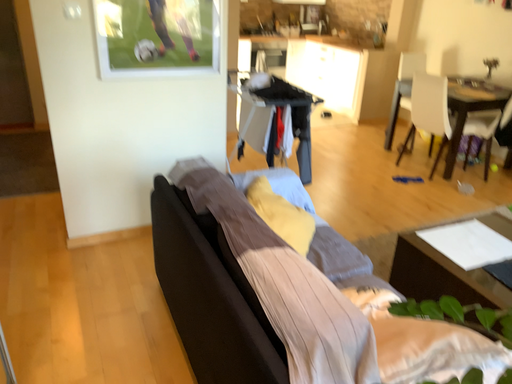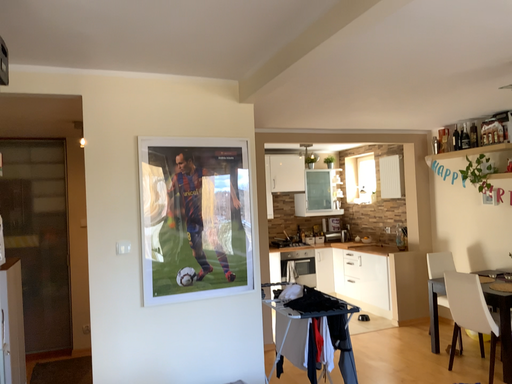
Question: How did the camera likely rotate when shooting the video?

Choices:
 (A) rotated upward
 (B) rotated downward

Answer: (A)